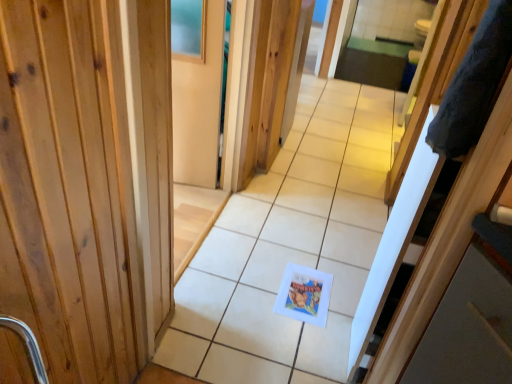
Image resolution: width=512 pixels, height=384 pixels. In order to click on free space above white matte postcard at center (from a real-world perspective) in this screenshot , I will do `click(303, 292)`.